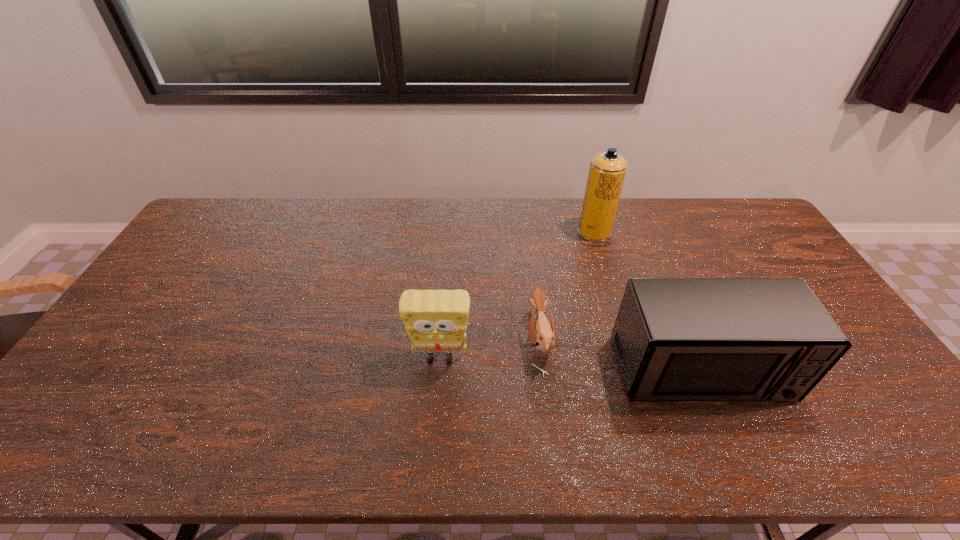
The width and height of the screenshot is (960, 540). I want to click on vacant space located at the beak of the second object from left to right, so pos(505,341).

At what (x,y) coordinates should I click in order to perform the action: click on free location located at the beak of the second object from left to right. Please return your answer as a coordinate pair (x, y). The image size is (960, 540). Looking at the image, I should click on (418, 341).

The image size is (960, 540). Find the location of `object present at the far edge`. object present at the far edge is located at coordinates (607, 171).

This screenshot has height=540, width=960. What are the coordinates of `vacant space at the far edge of the desktop` in the screenshot? It's located at (476, 198).

Where is `vacant space at the near edge of the desktop`? vacant space at the near edge of the desktop is located at coordinates (420, 428).

Find the location of a particular element. The height and width of the screenshot is (540, 960). vacant space at the left edge of the desktop is located at coordinates (119, 362).

This screenshot has width=960, height=540. What are the coordinates of `free space at the far left corner` in the screenshot? It's located at (209, 227).

At what (x,y) coordinates should I click in order to perform the action: click on blank space at the near right corner. Please return your answer as a coordinate pair (x, y). Looking at the image, I should click on (867, 443).

This screenshot has width=960, height=540. I want to click on free area in between the bird and the farthest object, so click(566, 287).

Find the location of `vacant space in between the leftmost object and the microwave_oven`. vacant space in between the leftmost object and the microwave_oven is located at coordinates (570, 364).